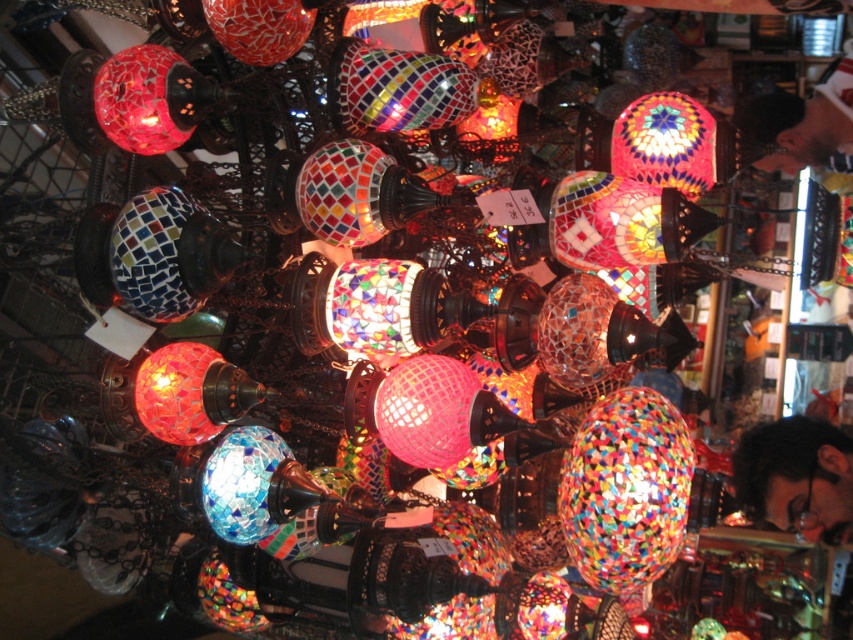
Question: Which point is farther to the camera?

Choices:
 (A) dark brown leather jacket at upper right
 (B) mosaic glass lamp at upper left
 (C) dark hair at lower right
 (D) pink mosaic ball at center

Answer: (C)

Question: Can you confirm if pink mosaic ball at center is bigger than mosaic glass lampshade at upper right?

Choices:
 (A) yes
 (B) no

Answer: (B)

Question: Which object is the closest to the mosaic glass lampshade at upper right?

Choices:
 (A) mosaic glass lamp at upper left
 (B) pink mosaic ball at center
 (C) dark brown leather jacket at upper right

Answer: (B)

Question: Which point is closer to the camera?

Choices:
 (A) (769, 426)
 (B) (773, 131)
 (C) (669, 92)
 (D) (463, 436)

Answer: (D)

Question: Is dark hair at lower right to the left of mosaic glass lampshade at upper right from the viewer's perspective?

Choices:
 (A) yes
 (B) no

Answer: (B)

Question: Is pink mosaic ball at center positioned at the back of mosaic glass lampshade at upper right?

Choices:
 (A) no
 (B) yes

Answer: (A)